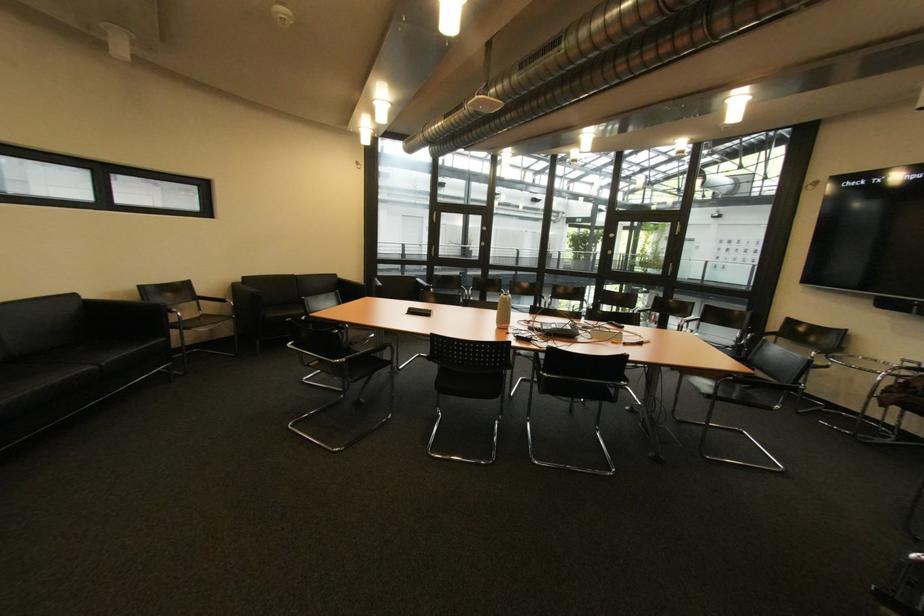
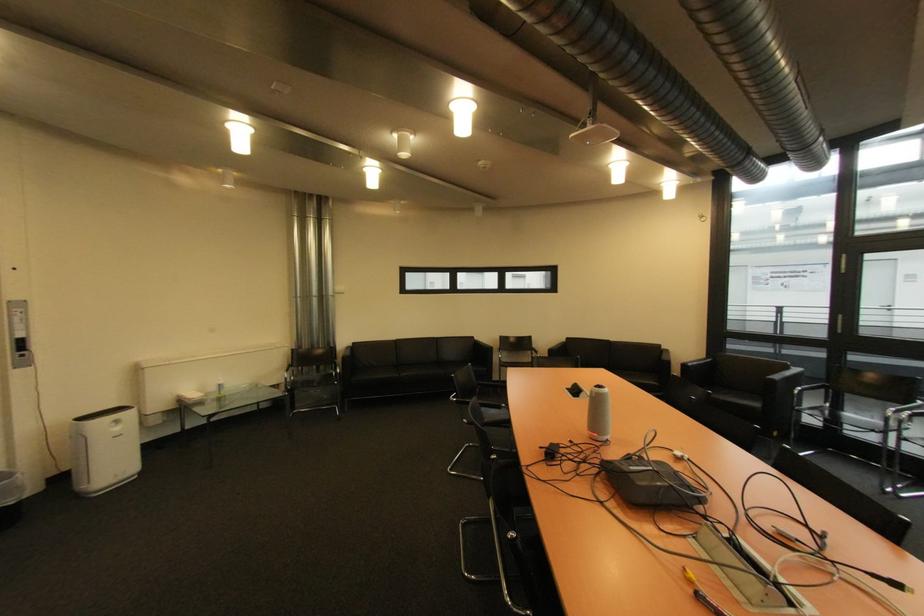
Find the pixel in the second image that matches [415,314] in the first image.

(578, 389)